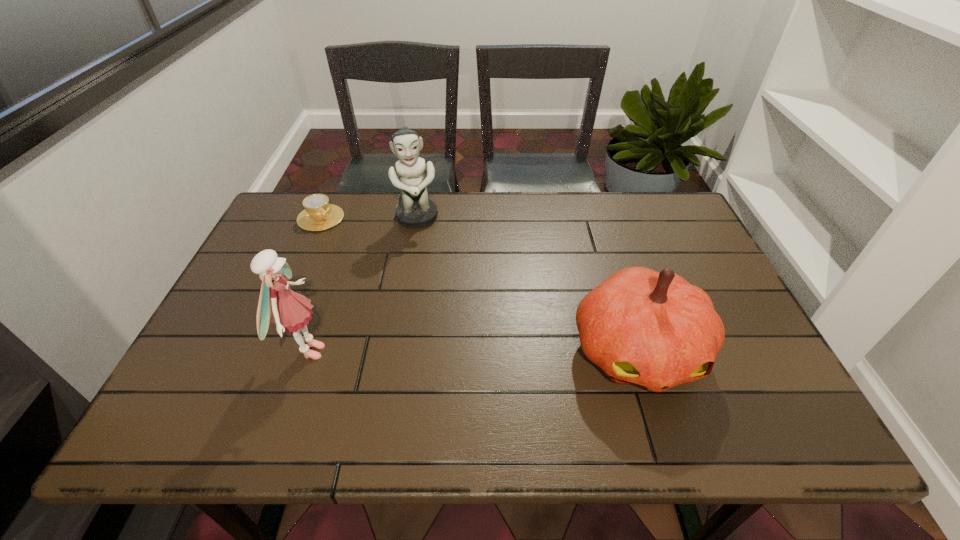
This screenshot has height=540, width=960. What are the coordinates of `doll` in the screenshot? It's located at (290, 311).

Find the location of a particular element. The image size is (960, 540). pumpkin is located at coordinates (653, 329).

Find the location of `the third tallest object`. the third tallest object is located at coordinates (653, 329).

Find the location of a particular element. The width and height of the screenshot is (960, 540). the third object from left to right is located at coordinates (416, 211).

Image resolution: width=960 pixels, height=540 pixels. Find the location of `the shortest object`. the shortest object is located at coordinates (318, 215).

Image resolution: width=960 pixels, height=540 pixels. What are the coordinates of `vacant region located on the front-facing side of the doll` in the screenshot? It's located at (468, 352).

You are a GUI agent. You are given a task and a screenshot of the screen. Output one action in this format:
    pyautogui.click(x=<x>, y=<y>)
    Task: Click on the free location located 0.150m on the front-facing side of the figurine
    
    Given the screenshot: What is the action you would take?
    pyautogui.click(x=423, y=266)

Locate an element on the screen. Image resolution: width=960 pixels, height=540 pixels. vacant space situated 0.400m on the front-facing side of the figurine is located at coordinates (433, 337).

The height and width of the screenshot is (540, 960). I want to click on free space located on the front-facing side of the figurine, so click(x=421, y=250).

This screenshot has height=540, width=960. Identify the location of vacant space located 0.370m with the handle on the side of the cup. (392, 300).